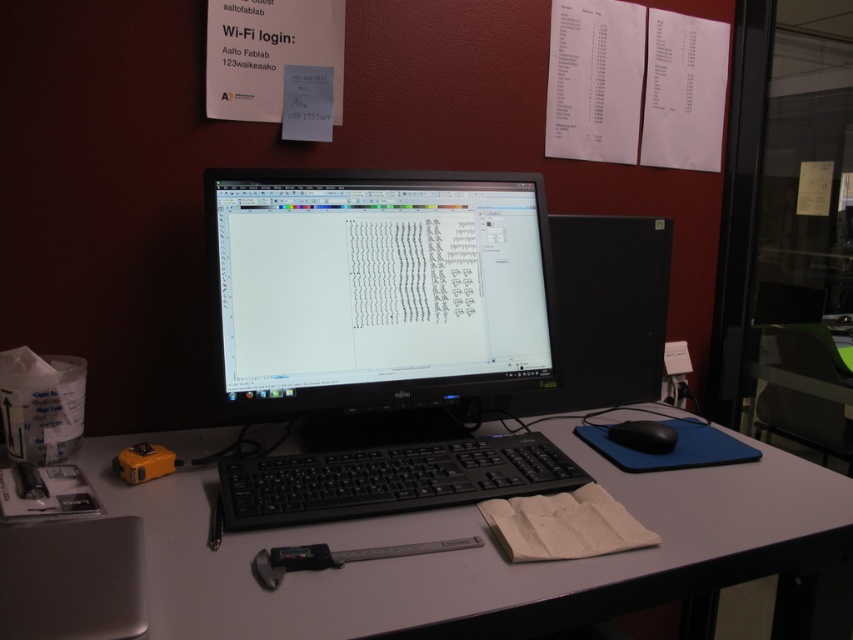
Can you confirm if black matte monitor at center is bigger than black plastic keyboard at center?

Yes, black matte monitor at center is bigger than black plastic keyboard at center.

Can you confirm if black matte monitor at center is taller than black plastic keyboard at center?

Yes.

Locate an element on the screen. black matte monitor at center is located at coordinates (378, 333).

Between black plastic keyboard at center and silver metallic caliper at center, which one is positioned higher?

black plastic keyboard at center is higher up.

Is black plastic keyboard at center further to camera compared to silver metallic caliper at center?

That is True.

Is point (283, 486) closer to camera compared to point (303, 552)?

No, (283, 486) is further to viewer.

Where is `black plastic keyboard at center`? The image size is (853, 640). black plastic keyboard at center is located at coordinates (390, 480).

Which is in front, point (376, 512) or point (643, 429)?

Point (376, 512)

Is point (387, 476) positioned after point (637, 433)?

No, it is not.

Where is `black plastic keyboard at center`? This screenshot has width=853, height=640. black plastic keyboard at center is located at coordinates (390, 480).